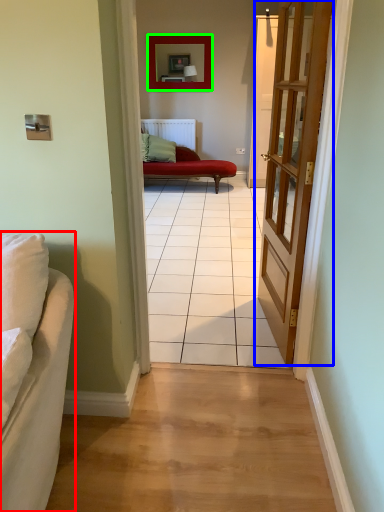
Question: Which object is the closest to the studio couch (highlighted by a red box)? Choose among these: door (highlighted by a blue box) or picture frame (highlighted by a green box).

Choices:
 (A) door
 (B) picture frame

Answer: (A)